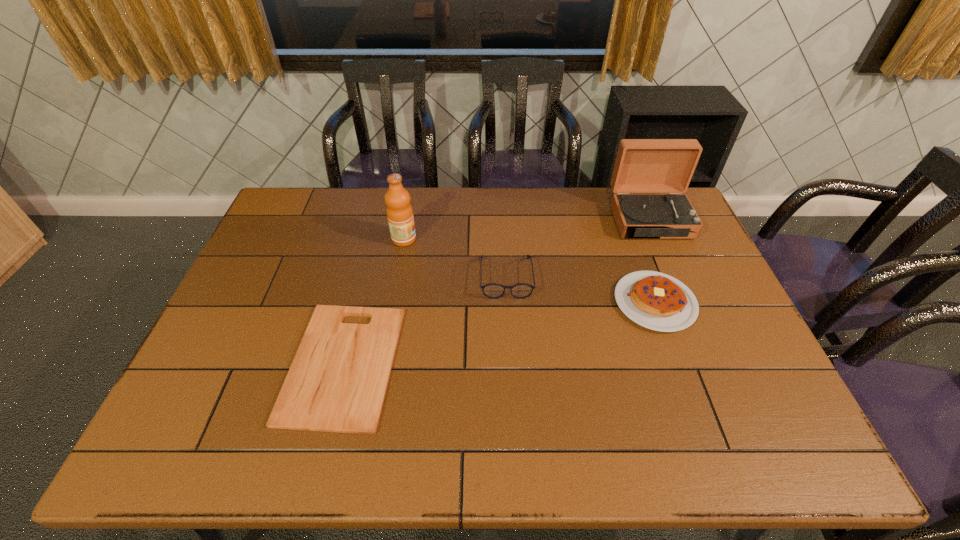
Find the location of a particular element. The height and width of the screenshot is (540, 960). vacant space at the far left corner of the desktop is located at coordinates 329,191.

The height and width of the screenshot is (540, 960). I want to click on free spot at the near left corner of the desktop, so click(197, 437).

The width and height of the screenshot is (960, 540). In the image, there is a desktop. What are the coordinates of `free region at the near right corner` in the screenshot? It's located at (766, 456).

I want to click on vacant region between the chopping board and the fruit juice, so click(373, 301).

This screenshot has width=960, height=540. Identify the location of free spot between the pancake and the phonograph record. (652, 261).

The height and width of the screenshot is (540, 960). Find the location of `vacant area between the phonograph record and the pancake`. vacant area between the phonograph record and the pancake is located at coordinates (652, 261).

At what (x,y) coordinates should I click in order to perform the action: click on free space between the fruit juice and the third shortest object. Please return your answer as a coordinate pair (x, y). Looking at the image, I should click on (455, 258).

Identify the location of free space that is in between the phonograph record and the third object from left to right. This screenshot has height=540, width=960. (578, 248).

In order to click on free space between the fruit juice and the chopping board in this screenshot , I will do `click(373, 301)`.

The height and width of the screenshot is (540, 960). I want to click on vacant point located between the fruit juice and the spectacles, so click(455, 258).